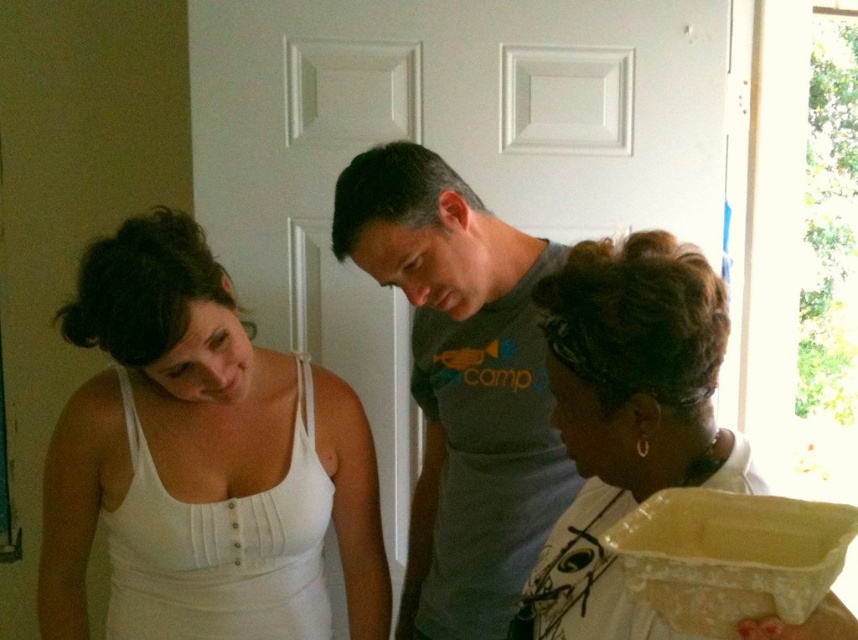
Between white fabric at lower right and white fabric tank top at lower left, which one appears on the left side from the viewer's perspective?

white fabric tank top at lower left is more to the left.

Which of these two, white fabric at lower right or white fabric tank top at lower left, stands shorter?

With less height is white fabric at lower right.

Is point (603, 582) farther from camera compared to point (449, 232)?

No, (603, 582) is closer to viewer.

The width and height of the screenshot is (858, 640). Identify the location of white fabric at lower right. (627, 417).

What do you see at coordinates (186, 358) in the screenshot?
I see `white fabric tank top at left` at bounding box center [186, 358].

Is point (204, 316) behind point (626, 300)?

Yes, point (204, 316) is behind point (626, 300).

Locate an element on the screen. This screenshot has height=640, width=858. white fabric tank top at left is located at coordinates (186, 358).

Between point (466, 468) and point (754, 547), which one is positioned behind?

The point (466, 468) is behind.

Is point (458, 609) farther from viewer compared to point (816, 570)?

Yes, point (458, 609) is behind point (816, 570).

Where is `gray cotton t-shirt at center`? This screenshot has height=640, width=858. gray cotton t-shirt at center is located at coordinates (461, 385).